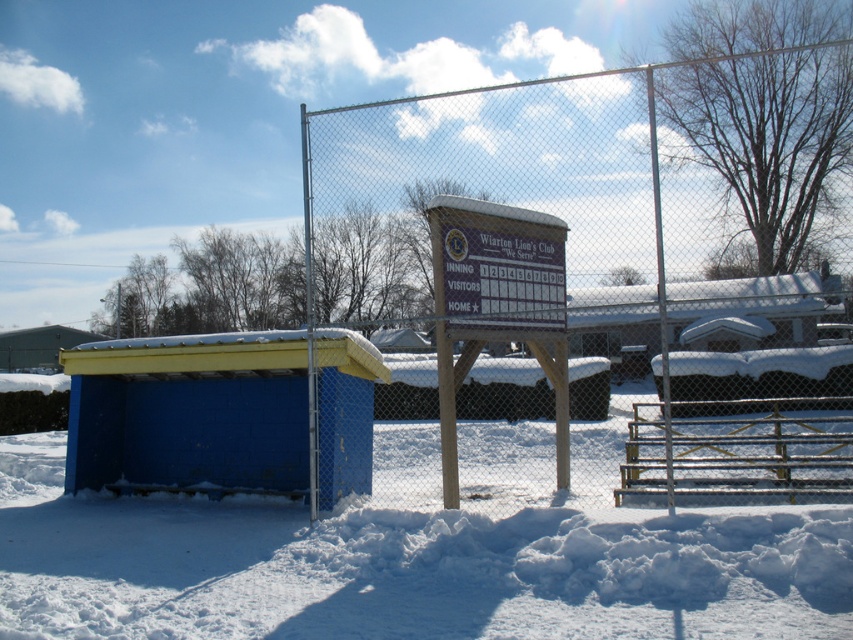
Consider the image. Is metallic chain-link fence at center smaller than blue painted wood shed at left?

No.

Is metallic chain-link fence at center bigger than blue painted wood shed at left?

Yes.

Between point (570, 337) and point (265, 429), which one is positioned behind?

The point (570, 337) is more distant.

Identify the location of metallic chain-link fence at center. (596, 260).

Between metallic chain-link fence at center and yellow plastic hut at lower left, which one appears on the left side from the viewer's perspective?

Positioned to the left is yellow plastic hut at lower left.

Does point (596, 164) lie in front of point (62, 340)?

Yes, it is.

Where is `metallic chain-link fence at center`? metallic chain-link fence at center is located at coordinates (596, 260).

Is metallic chain-link fence at center bigger than wooden sign at center?

Yes, metallic chain-link fence at center is bigger than wooden sign at center.

Which of these two, metallic chain-link fence at center or wooden sign at center, stands taller?

Standing taller between the two is metallic chain-link fence at center.

I want to click on metallic chain-link fence at center, so click(596, 260).